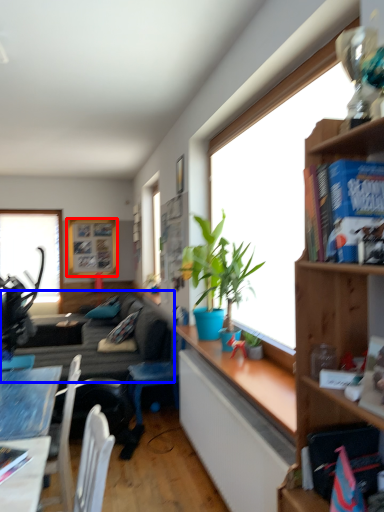
Question: Which of the following is the closest to the observer, picture frame (highlighted by a red box) or studio couch (highlighted by a blue box)?

Choices:
 (A) picture frame
 (B) studio couch

Answer: (B)